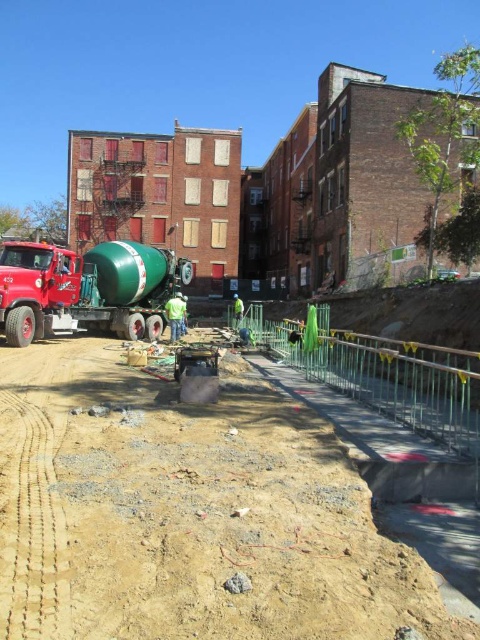
Question: Which of these objects is positioned closest to the green matte trailer truck at center?

Choices:
 (A) green fabric construction worker at center
 (B) brown sandy dirt track at lower center

Answer: (A)

Question: Is brown sandy dirt track at lower center smaller than green fabric construction worker at center?

Choices:
 (A) yes
 (B) no

Answer: (B)

Question: Which point appears closest to the camera in this image?

Choices:
 (A) (80, 301)
 (B) (186, 312)
 (C) (267, 419)

Answer: (C)

Question: Can you confirm if green matte trailer truck at center is positioned to the right of green fabric construction worker at center?

Choices:
 (A) no
 (B) yes

Answer: (A)

Question: Does green matte trailer truck at center have a greater width compared to green fabric construction worker at center?

Choices:
 (A) yes
 (B) no

Answer: (A)

Question: Which object is the farthest from the brown sandy dirt track at lower center?

Choices:
 (A) green matte trailer truck at center
 (B) green fabric construction worker at center

Answer: (B)